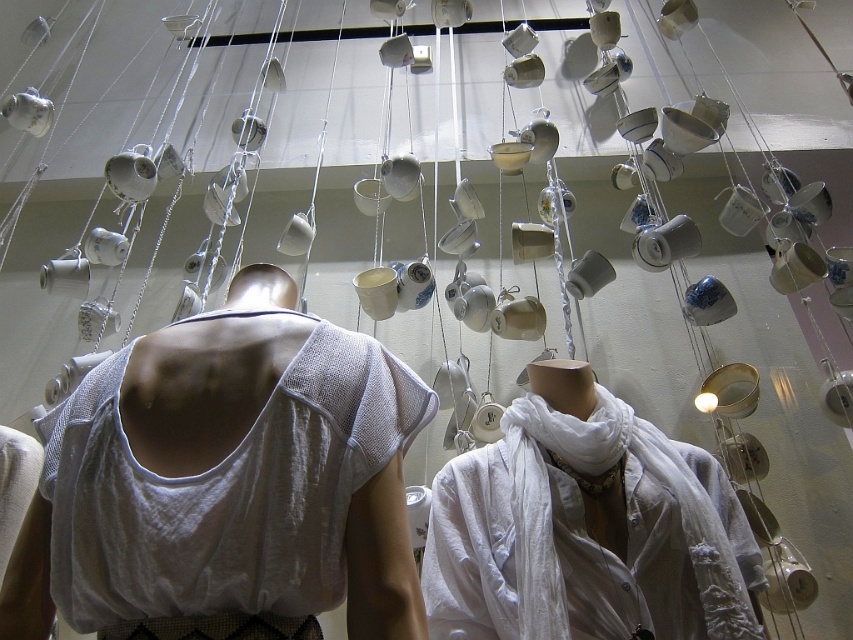
Locate an element on the screen. white mesh tank top at center is located at coordinates (227, 477).

Does white mesh tank top at center have a larger size compared to white cotton scarf at center?

No.

The image size is (853, 640). In order to click on white mesh tank top at center in this screenshot , I will do `click(227, 477)`.

At what (x,y) coordinates should I click in order to perform the action: click on white mesh tank top at center. Please return your answer as a coordinate pair (x, y). This screenshot has height=640, width=853. Looking at the image, I should click on (227, 477).